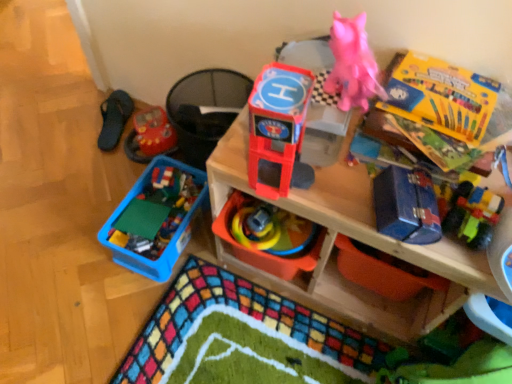
Question: From a real-world perspective, relative to blue plastic container at lower left, the 4th toy viewed from the front, is shiny plastic toy helicopter at center, which ranks as the first toy in front-to-back order, vertically above or below?

Choices:
 (A) below
 (B) above

Answer: (B)

Question: Does point (268, 135) appear closer or farther from the camera than point (160, 256)?

Choices:
 (A) closer
 (B) farther

Answer: (A)

Question: Considering the real-world distances, which object is farthest from the matte plastic shelf at upper center?

Choices:
 (A) blue plastic container at lower left, the 4th toy viewed from the front
 (B) rubberized red toy car at left, the 1th toy positioned from the back
 (C) black fabric slipper at left
 (D) yellow cardboard box at upper right, which appears as the third storage box when ordered from the bottom
 (E) matte plastic toy at upper center, which is the second storage box in bottom-to-top order

Answer: (C)

Question: Based on their relative distances, which object is farther from the blue metallic toolbox at upper right, positioned as the 3th storage box in top-to-bottom order?

Choices:
 (A) rubberized plastic toy at center, placed as the 3th toy when sorted from front to back
 (B) blue metallic toolbox at right, placed as the 4th toy when sorted from back to front
 (C) shiny plastic toy helicopter at center, the 5th toy in the back-to-front sequence
 (D) yellow cardboard box at upper right, which appears as the third storage box when ordered from the bottom
 (E) blue plastic container at lower left, the second toy positioned from the back

Answer: (E)